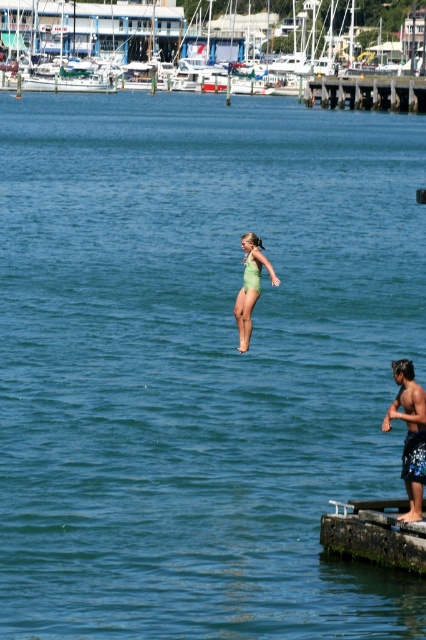
Is white glossy boat at upper center to the left of green fabric swimsuit at center from the viewer's perspective?

Yes, white glossy boat at upper center is to the left of green fabric swimsuit at center.

Does white glossy boat at upper center have a larger size compared to green fabric swimsuit at center?

Yes.

Between point (385, 8) and point (245, 248), which one is positioned in front?

Positioned in front is point (245, 248).

Locate an element on the screen. white glossy boat at upper center is located at coordinates (187, 28).

Which of these two, green mossy wood dock at lower right or green fabric swimsuit at center, stands shorter?

green fabric swimsuit at center is shorter.

Does green mossy wood dock at lower right have a greater width compared to green fabric swimsuit at center?

Yes, green mossy wood dock at lower right is wider than green fabric swimsuit at center.

Image resolution: width=426 pixels, height=640 pixels. In order to click on green mossy wood dock at lower right in this screenshot , I will do `click(374, 532)`.

Is white glossy boat at upper center bigger than blue patterned shorts at right?

Indeed, white glossy boat at upper center has a larger size compared to blue patterned shorts at right.

Between white glossy boat at upper center and blue patterned shorts at right, which one is positioned higher?

Positioned higher is white glossy boat at upper center.

Who is more forward, (219,35) or (420,474)?

Point (420,474) is more forward.

The height and width of the screenshot is (640, 426). I want to click on white glossy boat at upper center, so (x=187, y=28).